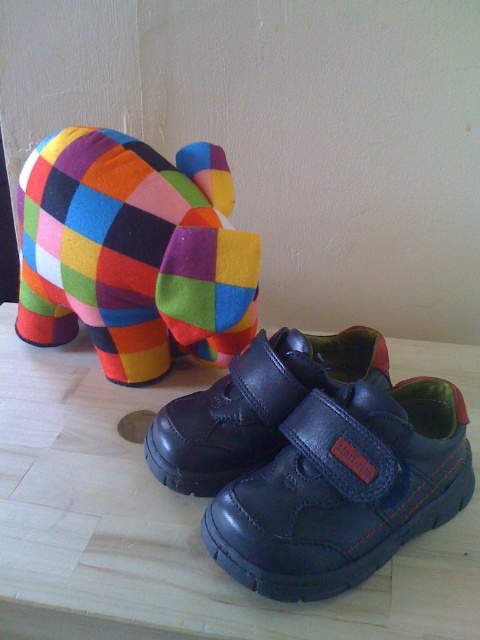
You are a child trying to reach your shiny black leather shoe at center and black leather shoe at lower center. Which one can you grab first without moving your feet?

The shiny black leather shoe at center is closer to the viewer, so you can grab it first without moving your feet.

You are standing in front of a table with a light wooden surface and an off white wall. You see a colorful felt elephant on the left and a pair of navy blue shoes on the right. There is a point at coordinates (383, 529). If you want to touch this point, which object would your hand pass closer to first, the colorful felt elephant or the navy blue shoes?

The point at coordinates (383, 529) is 38.61 inches away from the viewer. Since the elephant is on the left and the shoes are on the right, your hand would first pass closer to the navy blue shoes as they are positioned farther away from the viewer compared to the elephant. Wait, but actually, the distance given is for the point, not the objects. Hmm, maybe I need to clarify. The point is 38.61 inches away, so if the objects are at different distances, but the question is about the path of the hand moving

You are organizing a child room and need to place the multicolored felt elephant at upper left and the black leather shoe at lower center on a shelf. The shelf has a width of 50 cm. The elephant is 20 cm wide and the shoe is 15 cm wide. Is there enough space to place both items side by side without overlapping?

The multicolored felt elephant at upper left is 20 cm wide and the black leather shoe at lower center is 15 cm wide. Combined, they require 35 cm of space. Since the shelf is 50 cm wide, there is enough space to place both items side by side without overlapping.